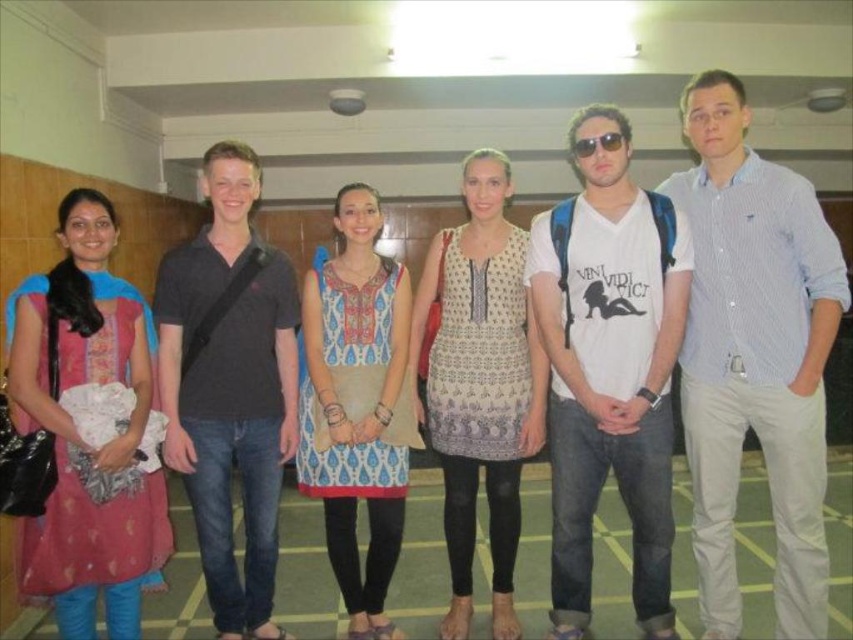
You are organizing a photo shoot and need to arrange two models wearing the blue striped shirt at center and the patterned fabric dress at center. Based on their sizes, which model should you place in the foreground to ensure they are clearly visible?

The blue striped shirt at center is bigger than the patterned fabric dress at center, so placing the model wearing the blue striped shirt at center in the foreground will ensure they are clearly visible.

You are an observer in the hallway. You notice the dark gray cotton polo shirt at center and the matte pink dress at left. Which one is positioned higher in the image?

The dark gray cotton polo shirt at center is located above the matte pink dress at left, so it is positioned higher in the image.

You are a photographer positioned in the hallway and want to capture both the dark gray cotton polo shirt at center and the matte pink dress at left in a single photo. Which object should you focus on first to ensure both are in clear view?

You should focus on the dark gray cotton polo shirt at center first because it is closer to you than the matte pink dress at left, ensuring both will be in clear view when focused on the closer object.